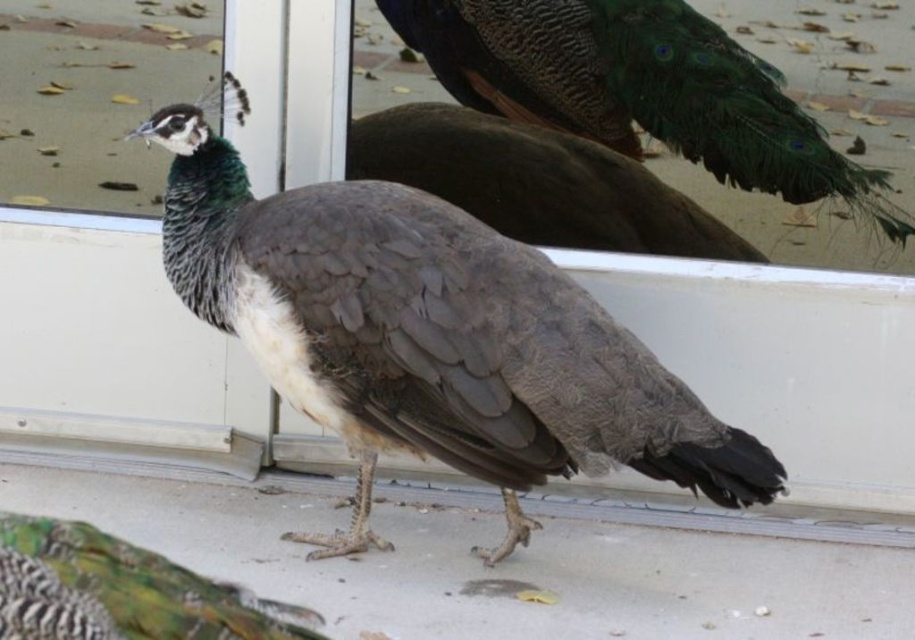
Who is taller, dark gray feathers at center or shiny green peacock at center?

dark gray feathers at center

From the picture: Which is more to the left, dark gray feathers at center or shiny green peacock at center?

dark gray feathers at center

Does point (343, 189) come closer to viewer compared to point (492, 90)?

Yes, it is in front of point (492, 90).

Where is `dark gray feathers at center`? The width and height of the screenshot is (915, 640). dark gray feathers at center is located at coordinates (429, 339).

Is dark gray feathers at center smaller than green iridescent feathers at center?

No, dark gray feathers at center is not smaller than green iridescent feathers at center.

Who is positioned more to the left, dark gray feathers at center or green iridescent feathers at center?

green iridescent feathers at center is more to the left.

What do you see at coordinates (429, 339) in the screenshot?
I see `dark gray feathers at center` at bounding box center [429, 339].

Where is `dark gray feathers at center`? dark gray feathers at center is located at coordinates (429, 339).

Who is positioned more to the right, shiny green peacock at center or green iridescent feathers at center?

Positioned to the right is shiny green peacock at center.

The height and width of the screenshot is (640, 915). What do you see at coordinates (660, 104) in the screenshot?
I see `shiny green peacock at center` at bounding box center [660, 104].

The width and height of the screenshot is (915, 640). What are the coordinates of `shiny green peacock at center` in the screenshot? It's located at (660, 104).